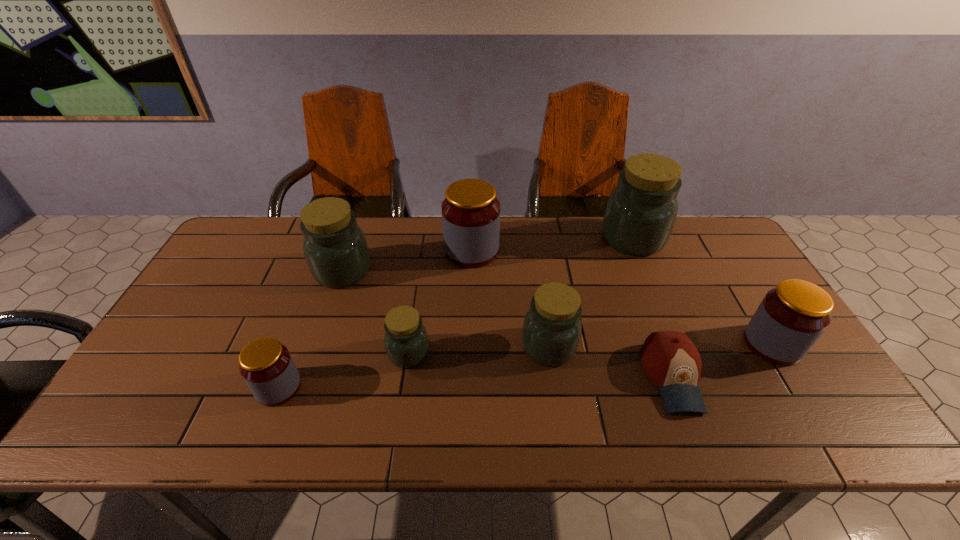
Locate an element on the screen. This screenshot has height=540, width=960. the third closest jar to the smallest red jar is located at coordinates (470, 212).

Locate an element on the screen. The height and width of the screenshot is (540, 960). jar that stands as the closest to the rightmost object is located at coordinates (641, 211).

Where is `the fourth closest green jar to the baseball cap`? Image resolution: width=960 pixels, height=540 pixels. the fourth closest green jar to the baseball cap is located at coordinates (335, 248).

Locate an element on the screen. green jar identified as the third closest to the biggest red jar is located at coordinates (406, 341).

Locate an element on the screen. The image size is (960, 540). red jar that is the closest to the sixth jar from left to right is located at coordinates (791, 317).

Where is `the closest red jar to the red baseball cap`? the closest red jar to the red baseball cap is located at coordinates (791, 317).

Locate an element on the screen. This screenshot has height=540, width=960. free space that satisfies the following two spatial constraints: 1. on the front side of the second biggest green jar; 2. on the right side of the second nearest red jar is located at coordinates (318, 344).

The width and height of the screenshot is (960, 540). Find the location of `blank space that satisfies the following two spatial constraints: 1. on the back side of the leftmost green jar; 2. on the right side of the tallest jar`. blank space that satisfies the following two spatial constraints: 1. on the back side of the leftmost green jar; 2. on the right side of the tallest jar is located at coordinates (353, 239).